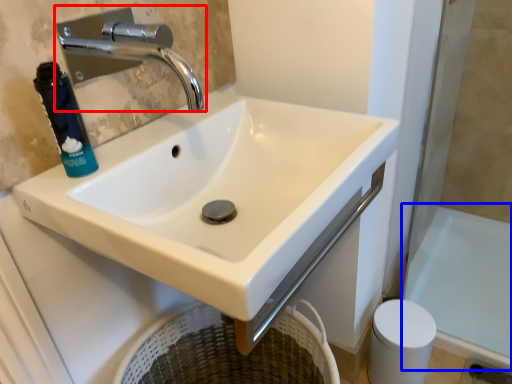
Question: Which of the following is the farthest to the observer, tap (highlighted by a red box) or bath (highlighted by a blue box)?

Choices:
 (A) tap
 (B) bath

Answer: (B)